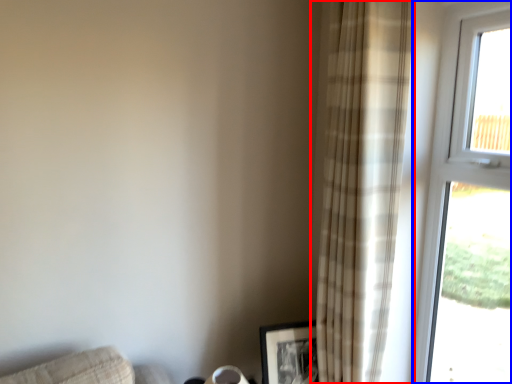
Question: Which point is further to the camera, curtain (highlighted by a red box) or window (highlighted by a blue box)?

Choices:
 (A) curtain
 (B) window

Answer: (A)